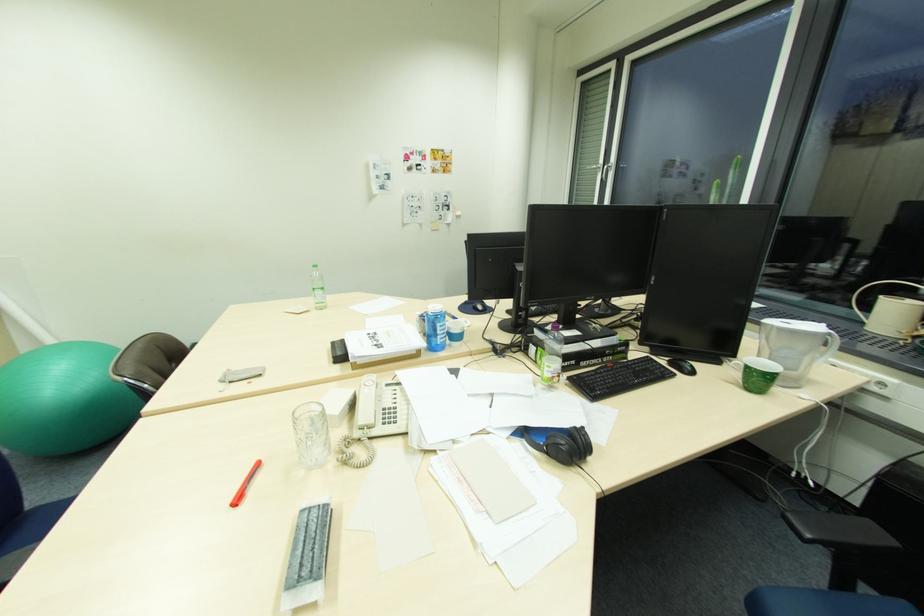
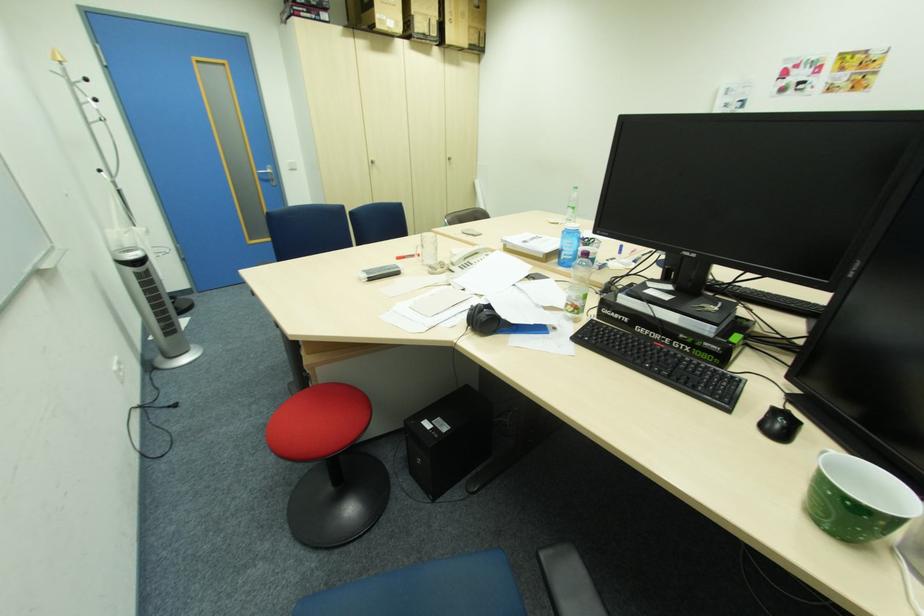
The point at (773, 378) is marked in the first image. Where is the corresponding point in the second image?

(833, 492)